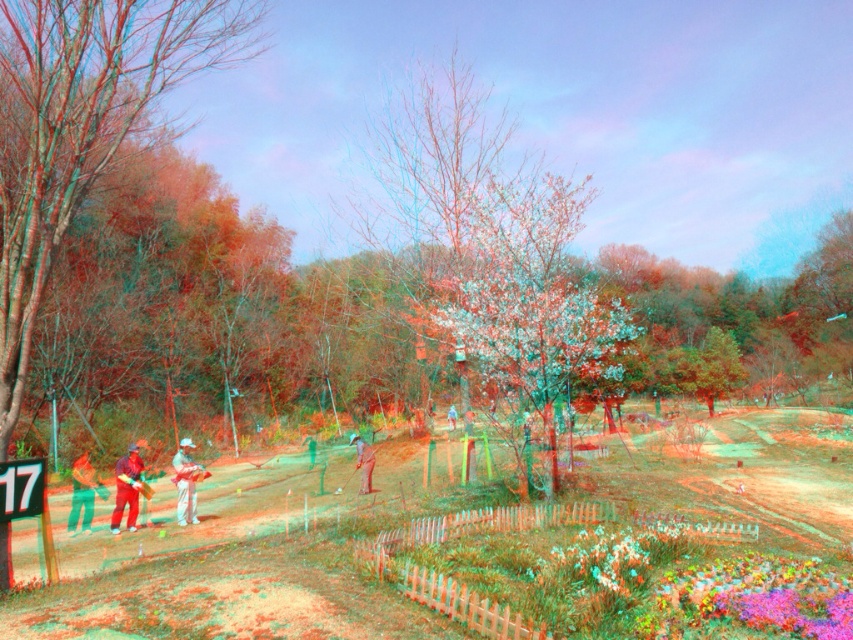
Does light brown fabric pants at center appear on the left side of light blue fabric jacket at center?

Yes, light brown fabric pants at center is to the left of light blue fabric jacket at center.

Where is `light brown fabric pants at center`? The width and height of the screenshot is (853, 640). light brown fabric pants at center is located at coordinates (186, 481).

Where is `light brown fabric pants at center`? light brown fabric pants at center is located at coordinates (186, 481).

Image resolution: width=853 pixels, height=640 pixels. What do you see at coordinates (750, 600) in the screenshot? I see `vibrant floral carpet at lower right` at bounding box center [750, 600].

Can you confirm if vibrant floral carpet at lower right is positioned below light brown fabric pants at center?

No, vibrant floral carpet at lower right is not below light brown fabric pants at center.

Is point (601, 557) in front of point (193, 484)?

Yes, it is.

Locate an element on the screen. The width and height of the screenshot is (853, 640). vibrant floral carpet at lower right is located at coordinates (750, 600).

Can you confirm if vibrant floral carpet at lower right is wider than matte gray shirt at center?

In fact, vibrant floral carpet at lower right might be narrower than matte gray shirt at center.

Between point (624, 579) and point (361, 444), which one is positioned behind?

Positioned behind is point (361, 444).

At what (x,y) coordinates should I click in order to perform the action: click on vibrant floral carpet at lower right. Please return your answer as a coordinate pair (x, y). This screenshot has width=853, height=640. Looking at the image, I should click on (750, 600).